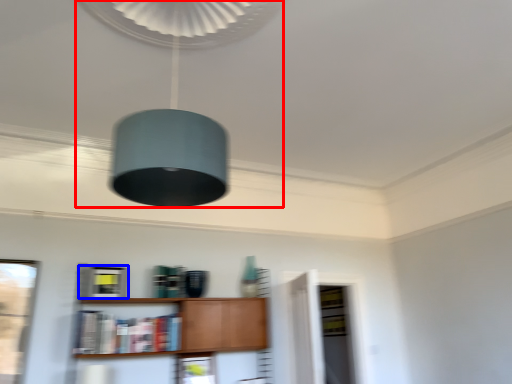
Question: Which object is further to the camera taking this photo, lamp (highlighted by a red box) or cabinetry (highlighted by a blue box)?

Choices:
 (A) lamp
 (B) cabinetry

Answer: (B)